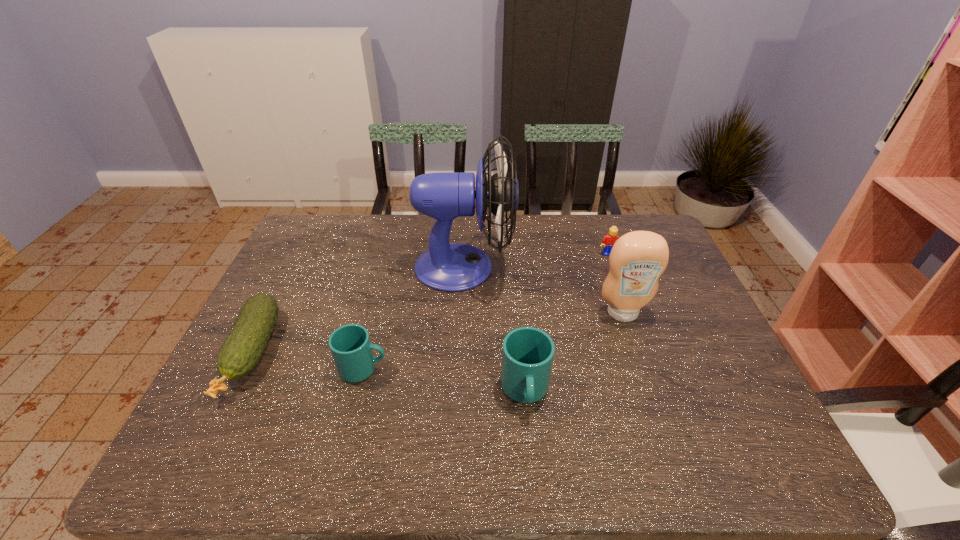
This screenshot has height=540, width=960. Find the location of `free point between the fan and the second object from left to right`. free point between the fan and the second object from left to right is located at coordinates (414, 318).

Locate an element on the screen. The width and height of the screenshot is (960, 540). vacant point located between the fourth shortest object and the condiment is located at coordinates (574, 352).

You are a GUI agent. You are given a task and a screenshot of the screen. Output one action in this format:
    pyautogui.click(x=<x>, y=<y>)
    Task: Click on the free space between the Lego and the fan
    The width and height of the screenshot is (960, 540).
    Given the screenshot: What is the action you would take?
    pyautogui.click(x=537, y=260)

This screenshot has height=540, width=960. Find the location of `vacant area that lies between the condiment and the left cup`. vacant area that lies between the condiment and the left cup is located at coordinates (493, 341).

You are a GUI agent. You are given a task and a screenshot of the screen. Output one action in this format:
    pyautogui.click(x=<x>, y=<y>)
    Task: Click on the free space that is in between the tallest object and the right cup
    
    Given the screenshot: What is the action you would take?
    pyautogui.click(x=494, y=329)

At what (x,y) coordinates should I click in order to perform the action: click on the second closest object to the shorter cup. Please return your answer as a coordinate pair (x, y). This screenshot has width=960, height=540. Looking at the image, I should click on (454, 267).

This screenshot has height=540, width=960. What are the coordinates of `the fourth closest object to the tallest object` in the screenshot? It's located at (608, 241).

In order to click on vacant point that satisfies the following two spatial constraints: 1. in front of the fan where the airflow is directed; 2. at the blossom end of the leftmost object in this screenshot , I will do `click(460, 353)`.

Where is `vacant space that satisfies the following two spatial constraints: 1. on the label of the fifth shortest object; 2. on the handle side of the shorter cup`? This screenshot has height=540, width=960. vacant space that satisfies the following two spatial constraints: 1. on the label of the fifth shortest object; 2. on the handle side of the shorter cup is located at coordinates (641, 369).

Find the location of a particular element. vacant space that satisfies the following two spatial constraints: 1. in front of the fan where the airflow is directed; 2. at the blossom end of the cucumber is located at coordinates (460, 353).